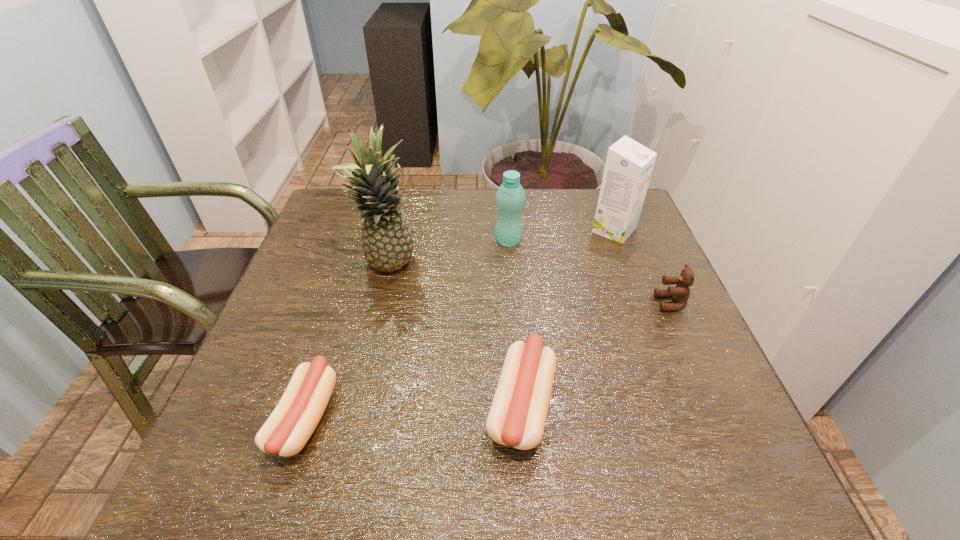
Please point out where to position a new sausage on the right to maintain spacing. Please provide its 2D coordinates. Your answer should be formatted as a tuple, i.e. [(x, y)], where the tuple contains the x and y coordinates of a point satisfying the conditions above.

[(728, 392)]